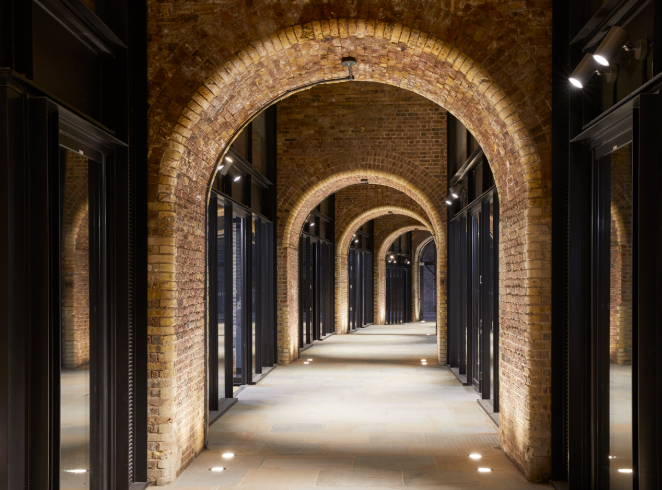
Where is `archway`? The width and height of the screenshot is (662, 490). archway is located at coordinates (439, 76), (369, 177), (380, 219), (397, 232), (424, 251).